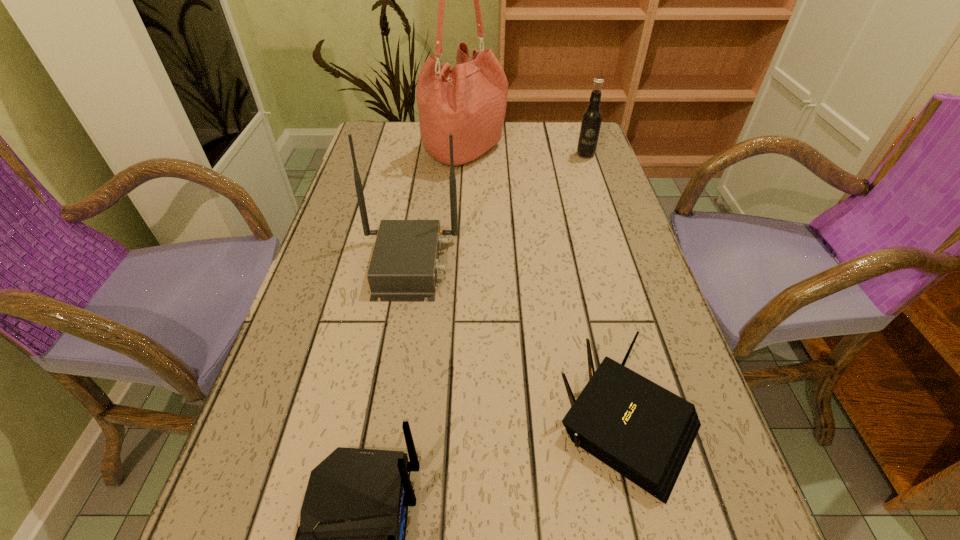
You are a GUI agent. You are given a task and a screenshot of the screen. Output one action in this format:
    pyautogui.click(x=<x>, y=<y>)
    Task: Click on the tallest object
    
    Given the screenshot: What is the action you would take?
    pyautogui.click(x=469, y=101)

The image size is (960, 540). I want to click on the tallest router, so click(x=404, y=266).

Locate an element on the screen. The height and width of the screenshot is (540, 960). the third nearest object is located at coordinates (404, 266).

Find the location of a particular element. This screenshot has height=540, width=960. root beer is located at coordinates (591, 120).

This screenshot has width=960, height=540. I want to click on the shortest object, so click(641, 430).

This screenshot has height=540, width=960. I want to click on the rightmost router, so click(x=641, y=430).

The image size is (960, 540). What are the coordinates of `free spot located on the left of the handbag` in the screenshot? It's located at (387, 151).

Locate an element on the screen. This screenshot has height=540, width=960. vacant space located on the back of the tallest router to connect cables is located at coordinates (480, 264).

This screenshot has width=960, height=540. Find the location of `free space located 0.190m on the label of the root beer`. free space located 0.190m on the label of the root beer is located at coordinates (599, 197).

Where is `vacant area located on the left of the rightmost router`? The height and width of the screenshot is (540, 960). vacant area located on the left of the rightmost router is located at coordinates (391, 423).